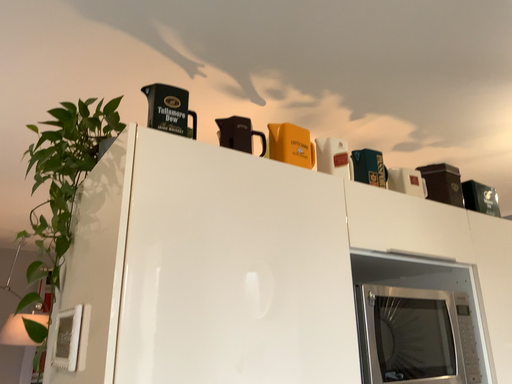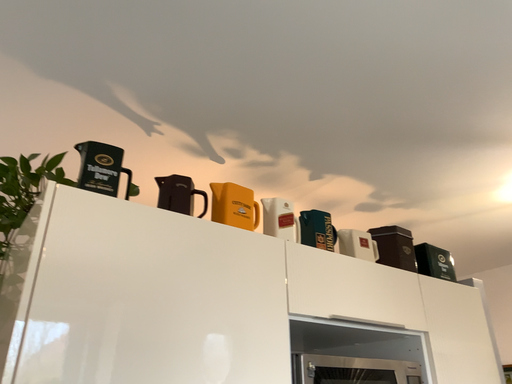
Question: Which way did the camera rotate in the video?

Choices:
 (A) rotated upward
 (B) rotated downward

Answer: (A)